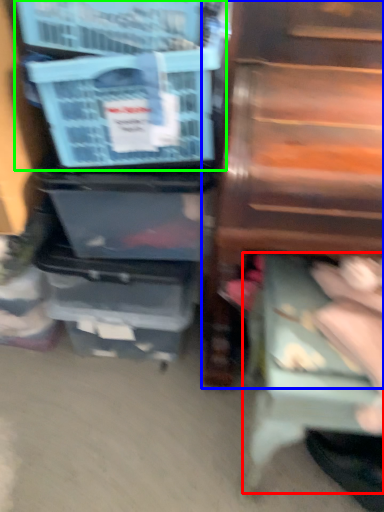
Question: Which object is positioned farthest from step stool (highlighted by a red box)? Select from furniture (highlighted by a blue box) and storage box (highlighted by a green box).

Choices:
 (A) furniture
 (B) storage box

Answer: (B)